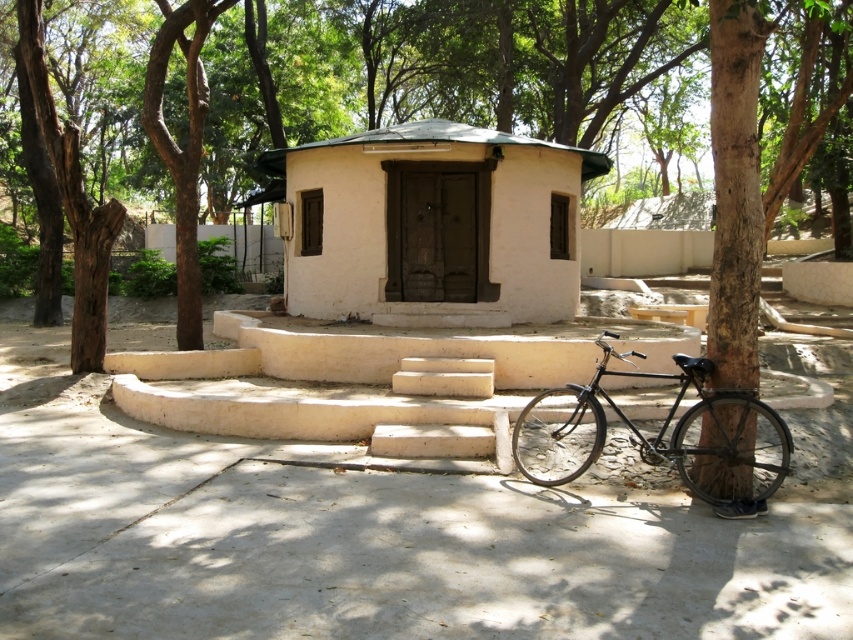
Which is above, white matte/hardobject at center or shiny black bicycle at lower right?

Positioned higher is white matte/hardobject at center.

Based on the photo, can you confirm if white matte/hardobject at center is positioned above shiny black bicycle at lower right?

Indeed, white matte/hardobject at center is positioned over shiny black bicycle at lower right.

Image resolution: width=853 pixels, height=640 pixels. I want to click on white matte/hardobject at center, so click(432, 225).

Where is `white matte/hardobject at center`? white matte/hardobject at center is located at coordinates (432, 225).